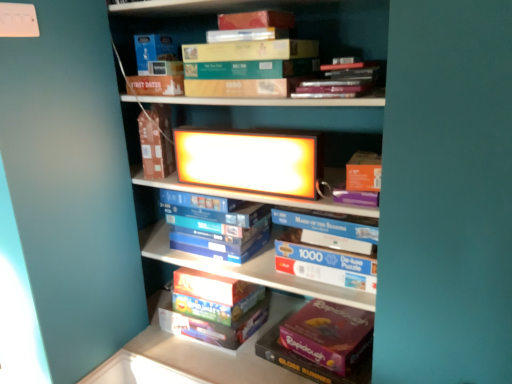
Question: Based on their positions, is bright yellow plastic lightbox at center located to the left or right of blue cardboard box at center, the second book in the bottom-to-top sequence?

Choices:
 (A) right
 (B) left

Answer: (A)

Question: Looking at the image, does bright yellow plastic lightbox at center seem bigger or smaller compared to blue cardboard box at center, which is counted as the 3th book, starting from the top?

Choices:
 (A) big
 (B) small

Answer: (B)

Question: Estimate the real-world distances between objects in this image. Which object is closer to the bright yellow plastic lightbox at center?

Choices:
 (A) blue cardboard box at center, the second book in the bottom-to-top sequence
 (B) matte cardboard book at upper center
 (C) matte green cardboard box at upper center, which appears as the 4th book when ordered from the bottom
 (D) matte cardboard box at center, which ranks as the 1th book in bottom-to-top order
 (E) matte cardboard book at upper center, marked as the second book in a top-to-bottom arrangement

Answer: (A)

Question: Which of these objects is positioned closest to the matte cardboard book at upper center, marked as the 3th book in a bottom-to-top arrangement?

Choices:
 (A) matte cardboard box at center, which ranks as the 1th book in bottom-to-top order
 (B) matte cardboard book at upper center
 (C) blue cardboard box at center, the second book in the bottom-to-top sequence
 (D) matte green cardboard box at upper center, which is the first book from top to bottom
 (E) bright yellow plastic lightbox at center

Answer: (D)